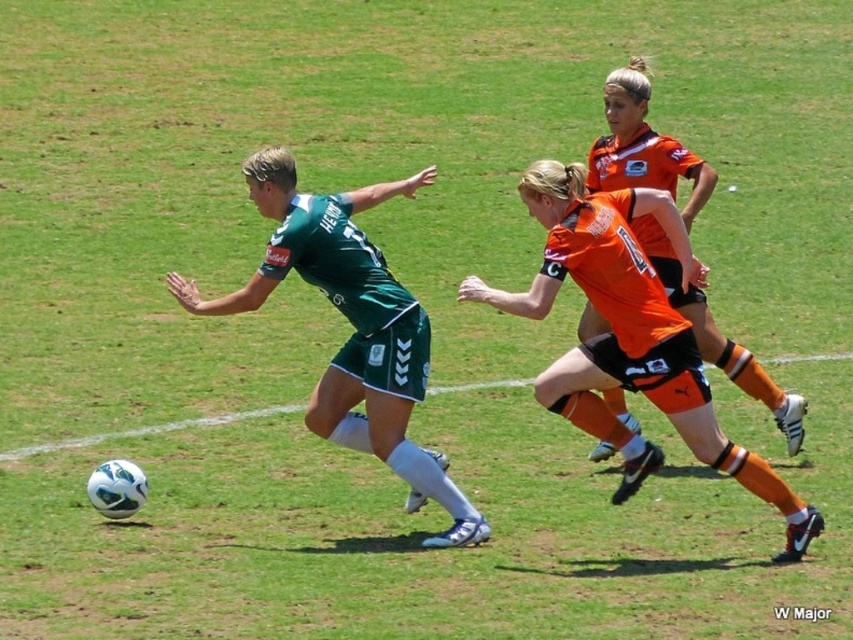
You are a soccer coach analyzing the field positions. You notice two points marked on the field. The first point is at coordinates point (399, 374) and the second point is at point (648, 152). Which point is closer to the soccer ball?

Point (399, 374) is in front of point (648, 152), so it is closer to the soccer ball.

You are a soccer coach analyzing the game. You notice the green matte jersey at center marked by point [352,324]. What is the position of this player relative to the field?

The green matte jersey at center is located at point [352,324] on the field.

What are the coordinates of the green matte jersey at center?

The coordinates of the green matte jersey at center are 0.509 in the x direction and 0.414 in the y direction.